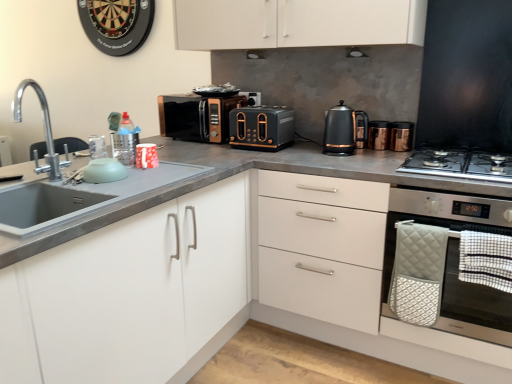
Question: Is black matte toaster at center, which is the second appliance in left-to-right order, to the left or to the right of black metallic kettle at upper right in the image?

Choices:
 (A) right
 (B) left

Answer: (B)

Question: Is point (x=251, y=99) positioned closer to the camera than point (x=344, y=147)?

Choices:
 (A) farther
 (B) closer

Answer: (A)

Question: Which object is positioned closest to the black matte toaster at center, which is the second appliance in left-to-right order?

Choices:
 (A) stainless steel gas stove at right
 (B) black metallic kettle at upper right
 (C) white matte cabinet at left, the first cabinetry viewed from the left
 (D) matte black toaster at center
 (E) stainless steel oven at right

Answer: (D)

Question: Estimate the real-world distances between objects in this image. Which object is closer to the black metallic kettle at upper right?

Choices:
 (A) black glossy microwave at center
 (B) gold metallic canister at upper right, the fourth appliance when ordered from left to right
 (C) black matte toaster at center, which is the second appliance in left-to-right order
 (D) black matte exhaust hood at upper center, the 2th exhaust hood in the right-to-left sequence
 (E) stainless steel gas stove at right

Answer: (B)